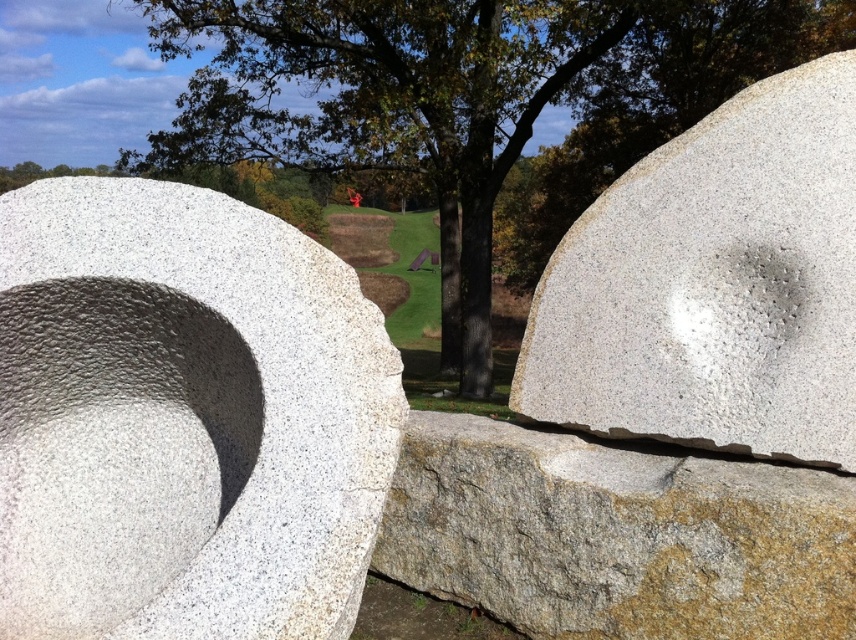
Question: Is white granite stone at center above gray rough concrete at center?

Choices:
 (A) yes
 (B) no

Answer: (A)

Question: Is white textured stone at center positioned at the back of gray rough concrete at center?

Choices:
 (A) no
 (B) yes

Answer: (A)

Question: Which of the following is the closest to the observer?

Choices:
 (A) (402, 474)
 (B) (681, 88)
 (C) (807, 228)
 (D) (7, 440)

Answer: (D)

Question: Where is green leafy tree at center located in relation to white granite stone at center in the image?

Choices:
 (A) below
 (B) above

Answer: (B)

Question: Which point is farther from the camera taking this photo?

Choices:
 (A) (621, 634)
 (B) (646, 22)

Answer: (B)

Question: Which of the following is the closest to the observer?

Choices:
 (A) gray rough concrete at center
 (B) white granite stone at center

Answer: (A)